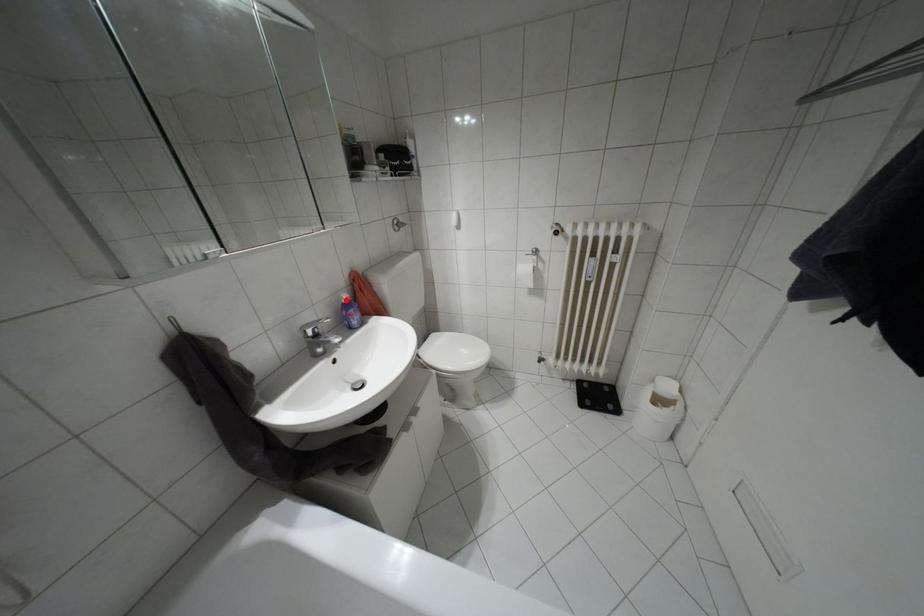
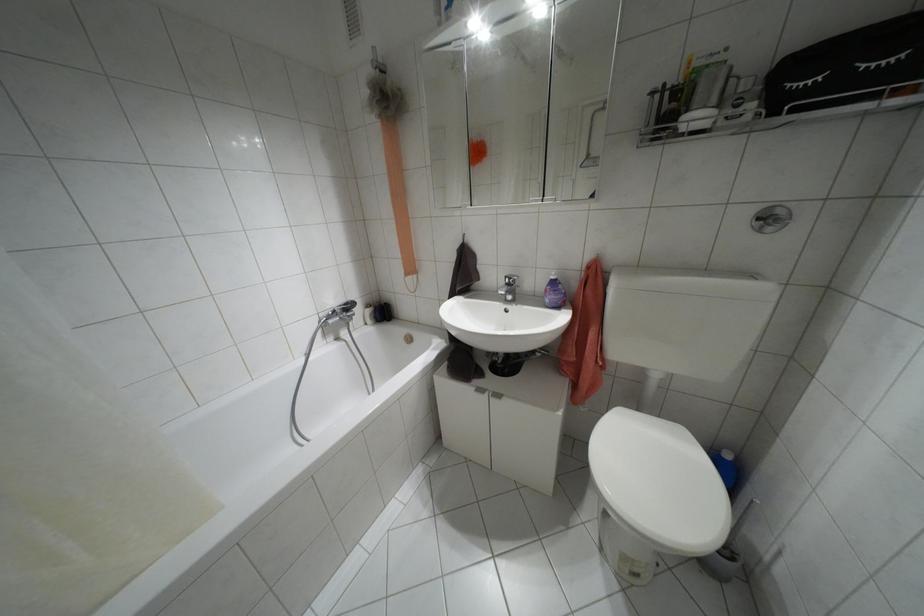
Where in the second image is the point corresponding to the highlighted location from the first image?

(552, 277)